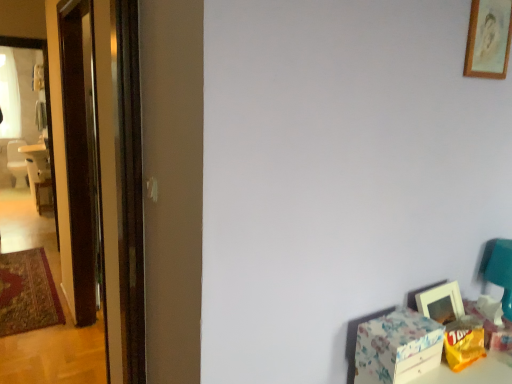
What do you see at coordinates (441, 303) in the screenshot? I see `matte white picture frame at lower right, the 2th picture frame in the top-to-bottom sequence` at bounding box center [441, 303].

Find the location of `floral paper box at lower right, the 1th box when ordered from left to right`. floral paper box at lower right, the 1th box when ordered from left to right is located at coordinates (397, 347).

Describe the element at coordinates (105, 173) in the screenshot. I see `transparent glass screen door at left` at that location.

How much space does yellow paper bag at lower right, positioned as the 2th box in left-to-right order, occupy horizontally?

It is 3.11 inches.

Find the location of a particular element. The height and width of the screenshot is (384, 512). matte white picture frame at lower right, which ranks as the first picture frame in bottom-to-top order is located at coordinates (441, 303).

Considering the points (479, 71) and (474, 325), which point is behind, point (479, 71) or point (474, 325)?

Point (474, 325)

This screenshot has height=384, width=512. I want to click on the 1st picture frame behind the yellow paper bag at lower right, the 1th box in the right-to-left sequence, starting your count from the anchor, so click(488, 39).

Would you say wooden frame at upper right, the first picture frame from the top, is outside yellow paper bag at lower right, the 1th box in the right-to-left sequence?

Yes, wooden frame at upper right, the first picture frame from the top, is outside of yellow paper bag at lower right, the 1th box in the right-to-left sequence.

Considering the sizes of objects floral paper box at lower right, which ranks as the second box in right-to-left order, and matte white picture frame at lower right, which ranks as the first picture frame in bottom-to-top order, in the image provided, who is smaller, floral paper box at lower right, which ranks as the second box in right-to-left order, or matte white picture frame at lower right, which ranks as the first picture frame in bottom-to-top order,?

matte white picture frame at lower right, which ranks as the first picture frame in bottom-to-top order.

Considering the positions of objects floral paper box at lower right, which ranks as the second box in right-to-left order, and matte white picture frame at lower right, which ranks as the first picture frame in bottom-to-top order, in the image provided, who is in front, floral paper box at lower right, which ranks as the second box in right-to-left order, or matte white picture frame at lower right, which ranks as the first picture frame in bottom-to-top order,?

floral paper box at lower right, which ranks as the second box in right-to-left order.

Is matte white picture frame at lower right, the 2th picture frame in the top-to-bottom sequence, at the back of floral paper box at lower right, which ranks as the second box in right-to-left order?

No, matte white picture frame at lower right, the 2th picture frame in the top-to-bottom sequence, is not at the back of floral paper box at lower right, which ranks as the second box in right-to-left order.

Between floral paper box at lower right, the 1th box when ordered from left to right, and matte white picture frame at lower right, which ranks as the first picture frame in bottom-to-top order, which one has larger width?

With larger width is floral paper box at lower right, the 1th box when ordered from left to right.

Is white plastic chair at left not near matte white picture frame at lower right, which ranks as the first picture frame in bottom-to-top order?

white plastic chair at left is positioned a significant distance from matte white picture frame at lower right, which ranks as the first picture frame in bottom-to-top order.

Which object is positioned more to the left, white plastic chair at left or matte white picture frame at lower right, which ranks as the first picture frame in bottom-to-top order?

Positioned to the left is white plastic chair at left.

Where is `the 1st picture frame in front when counting from the white plastic chair at left`? The width and height of the screenshot is (512, 384). the 1st picture frame in front when counting from the white plastic chair at left is located at coordinates (441, 303).

In the image, is white plastic chair at left positioned in front of or behind yellow paper bag at lower right, the 1th box in the right-to-left sequence?

Visually, white plastic chair at left is located behind yellow paper bag at lower right, the 1th box in the right-to-left sequence.

From a real-world perspective, who is located higher, white plastic chair at left or yellow paper bag at lower right, the 1th box in the right-to-left sequence?

yellow paper bag at lower right, the 1th box in the right-to-left sequence.

Does point (33, 150) come in front of point (464, 336)?

No, it is not.

Measure the distance from wooden frame at upper right, marked as the second picture frame in a bottom-to-top arrangement, to white plastic chair at left.

A distance of 3.73 meters exists between wooden frame at upper right, marked as the second picture frame in a bottom-to-top arrangement, and white plastic chair at left.

Considering the sizes of objects wooden frame at upper right, the first picture frame from the top, and white plastic chair at left in the image provided, who is shorter, wooden frame at upper right, the first picture frame from the top, or white plastic chair at left?

wooden frame at upper right, the first picture frame from the top.

Is white plastic chair at left completely or partially inside wooden frame at upper right, the first picture frame from the top?

No, white plastic chair at left is located outside of wooden frame at upper right, the first picture frame from the top.

Does point (468, 48) lie behind point (48, 168)?

No, it is not.

How much distance is there between wooden frame at upper right, marked as the second picture frame in a bottom-to-top arrangement, and matte white picture frame at lower right, which ranks as the first picture frame in bottom-to-top order?

wooden frame at upper right, marked as the second picture frame in a bottom-to-top arrangement, and matte white picture frame at lower right, which ranks as the first picture frame in bottom-to-top order, are 33.47 inches apart from each other.

Considering the relative sizes of wooden frame at upper right, the first picture frame from the top, and matte white picture frame at lower right, which ranks as the first picture frame in bottom-to-top order, in the image provided, is wooden frame at upper right, the first picture frame from the top, smaller than matte white picture frame at lower right, which ranks as the first picture frame in bottom-to-top order,?

Yes, wooden frame at upper right, the first picture frame from the top, is smaller than matte white picture frame at lower right, which ranks as the first picture frame in bottom-to-top order.

Looking at this image, is wooden frame at upper right, the first picture frame from the top, far away from matte white picture frame at lower right, the 2th picture frame in the top-to-bottom sequence?

No, wooden frame at upper right, the first picture frame from the top, is not far from matte white picture frame at lower right, the 2th picture frame in the top-to-bottom sequence.

Which object is thinner, wooden frame at upper right, the first picture frame from the top, or matte white picture frame at lower right, which ranks as the first picture frame in bottom-to-top order?

wooden frame at upper right, the first picture frame from the top.

Considering the relative positions of wooden frame at upper right, marked as the second picture frame in a bottom-to-top arrangement, and floral paper box at lower right, which ranks as the second box in right-to-left order, in the image provided, is wooden frame at upper right, marked as the second picture frame in a bottom-to-top arrangement, to the left of floral paper box at lower right, which ranks as the second box in right-to-left order, from the viewer's perspective?

No.

From the image's perspective, which box is the 1st one below the wooden frame at upper right, marked as the second picture frame in a bottom-to-top arrangement? Please provide its 2D coordinates.

[(397, 347)]

Can you tell me how much wooden frame at upper right, the first picture frame from the top, and floral paper box at lower right, which ranks as the second box in right-to-left order, differ in facing direction?

They differ by 2.24 degrees in their facing directions.

Choose the correct answer: Is wooden frame at upper right, the first picture frame from the top, inside floral paper box at lower right, which ranks as the second box in right-to-left order, or outside it?

wooden frame at upper right, the first picture frame from the top, is spatially situated outside floral paper box at lower right, which ranks as the second box in right-to-left order.

The image size is (512, 384). What are the coordinates of `the 1st box in front of the wooden frame at upper right, marked as the second picture frame in a bottom-to-top arrangement, counting from the anchor's position` in the screenshot? It's located at (464, 342).

Image resolution: width=512 pixels, height=384 pixels. In order to click on the 2nd picture frame behind the floral paper box at lower right, the 1th box when ordered from left to right, starting your count from the anchor in this screenshot , I will do `click(441, 303)`.

Based on the photo, considering their positions, is floral paper box at lower right, the 1th box when ordered from left to right, positioned further to matte white picture frame at lower right, the 2th picture frame in the top-to-bottom sequence, than transparent glass screen door at left?

transparent glass screen door at left is positioned further to the anchor matte white picture frame at lower right, the 2th picture frame in the top-to-bottom sequence.

Estimate the real-world distances between objects in this image. Which object is further from transparent glass screen door at left, floral paper box at lower right, the 1th box when ordered from left to right, or white plastic chair at left?

white plastic chair at left.

Which object lies further to the anchor point floral paper box at lower right, which ranks as the second box in right-to-left order, wooden frame at upper right, the first picture frame from the top, or white plastic chair at left?

white plastic chair at left is positioned further to the anchor floral paper box at lower right, which ranks as the second box in right-to-left order.

Based on their spatial positions, is floral paper box at lower right, the 1th box when ordered from left to right, or white plastic chair at left further from wooden frame at upper right, marked as the second picture frame in a bottom-to-top arrangement?

white plastic chair at left.

Looking at the image, which one is located closer to transparent glass screen door at left, matte white picture frame at lower right, which ranks as the first picture frame in bottom-to-top order, or floral paper box at lower right, the 1th box when ordered from left to right?

Among the two, floral paper box at lower right, the 1th box when ordered from left to right, is located nearer to transparent glass screen door at left.

Looking at the image, which one is located further to floral paper box at lower right, the 1th box when ordered from left to right, wooden frame at upper right, marked as the second picture frame in a bottom-to-top arrangement, or matte white picture frame at lower right, which ranks as the first picture frame in bottom-to-top order?

Based on the image, wooden frame at upper right, marked as the second picture frame in a bottom-to-top arrangement, appears to be further to floral paper box at lower right, the 1th box when ordered from left to right.

Considering their positions, is matte white picture frame at lower right, the 2th picture frame in the top-to-bottom sequence, positioned further to yellow paper bag at lower right, the 1th box in the right-to-left sequence, than floral paper box at lower right, the 1th box when ordered from left to right?

floral paper box at lower right, the 1th box when ordered from left to right, is positioned further to the anchor yellow paper bag at lower right, the 1th box in the right-to-left sequence.

Looking at the image, which one is located further to wooden frame at upper right, marked as the second picture frame in a bottom-to-top arrangement, floral paper box at lower right, which ranks as the second box in right-to-left order, or matte white picture frame at lower right, which ranks as the first picture frame in bottom-to-top order?

Based on the image, floral paper box at lower right, which ranks as the second box in right-to-left order, appears to be further to wooden frame at upper right, marked as the second picture frame in a bottom-to-top arrangement.

In order to click on picture frame between wooden frame at upper right, the first picture frame from the top, and white plastic chair at left, along the z-axis in this screenshot , I will do tap(441, 303).

The image size is (512, 384). Identify the location of screen door positioned between matte white picture frame at lower right, the 2th picture frame in the top-to-bottom sequence, and white plastic chair at left from near to far. (105, 173).

The image size is (512, 384). Identify the location of picture frame located between transparent glass screen door at left and yellow paper bag at lower right, positioned as the 2th box in left-to-right order, in the left-right direction. (441, 303).

Identify the location of picture frame between wooden frame at upper right, the first picture frame from the top, and floral paper box at lower right, the 1th box when ordered from left to right, from top to bottom. (441, 303).